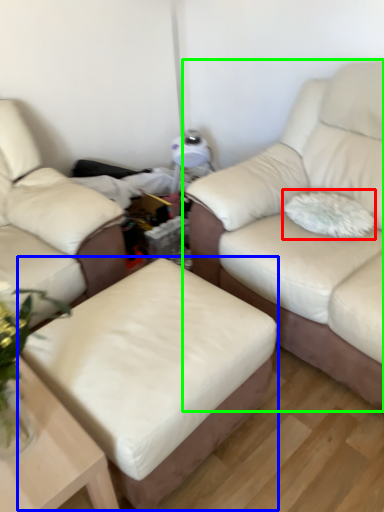
Question: Considering the real-world distances, which object is farthest from pillow (highlighted by a red box)? stool (highlighted by a blue box) or studio couch (highlighted by a green box)?

Choices:
 (A) stool
 (B) studio couch

Answer: (A)